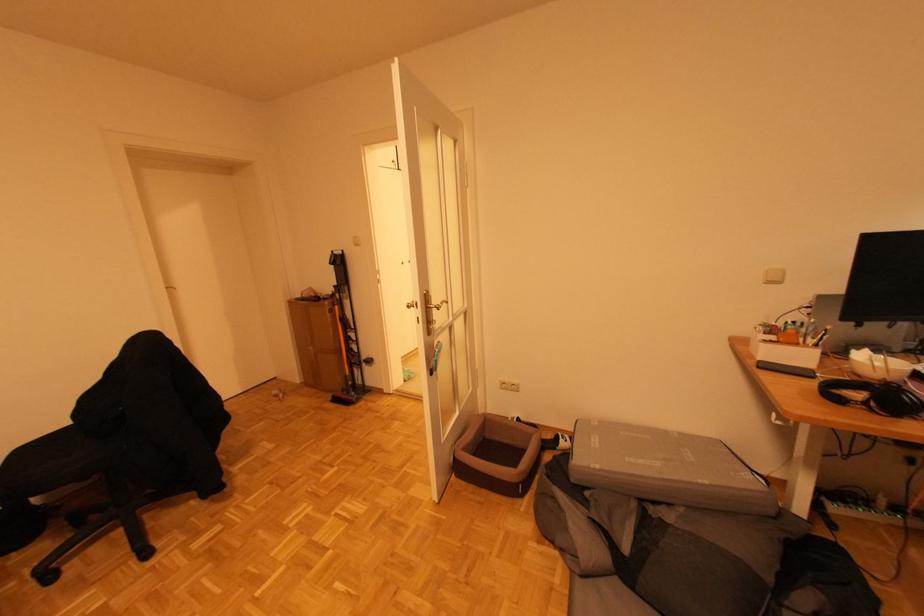
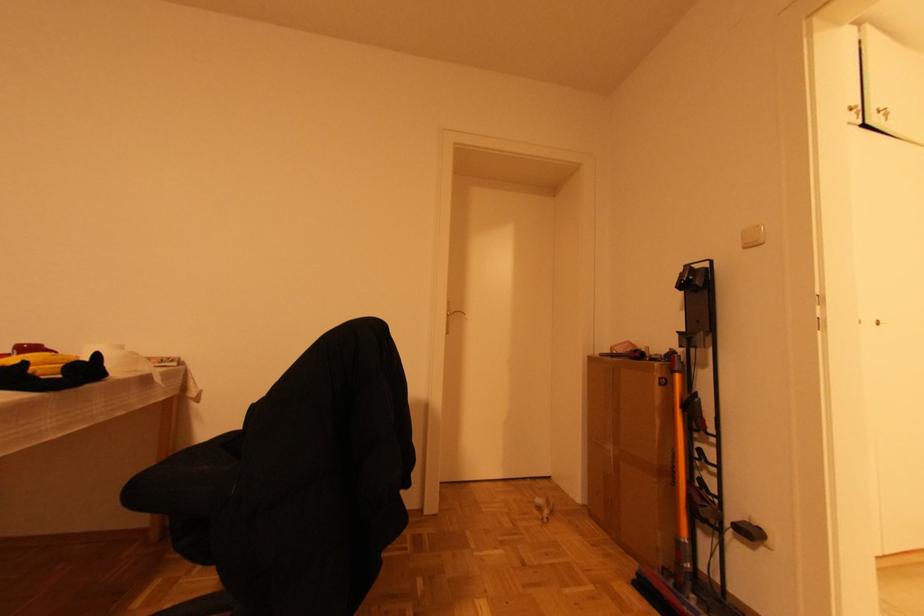
Find the pixel in the second image that matches [398,167] in the first image.

(859, 114)